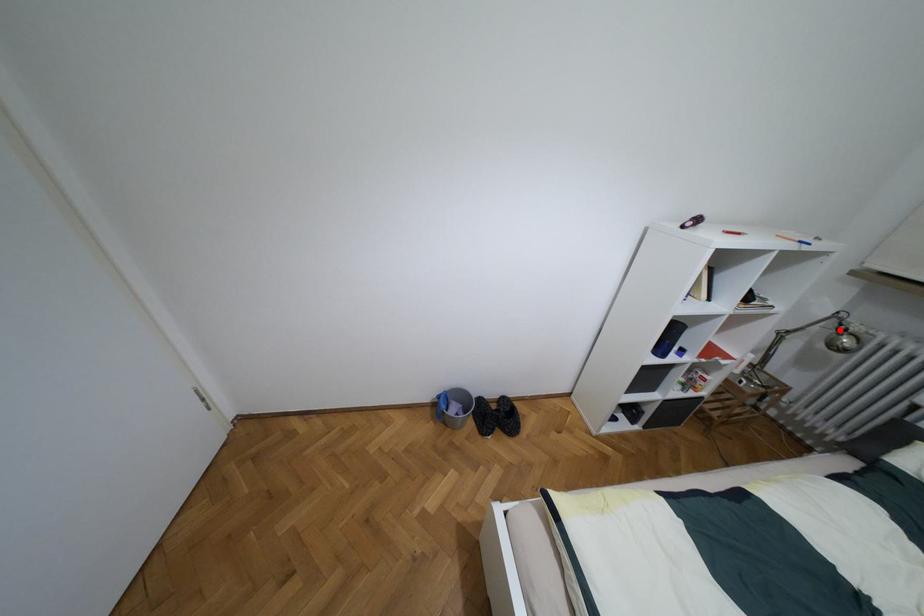
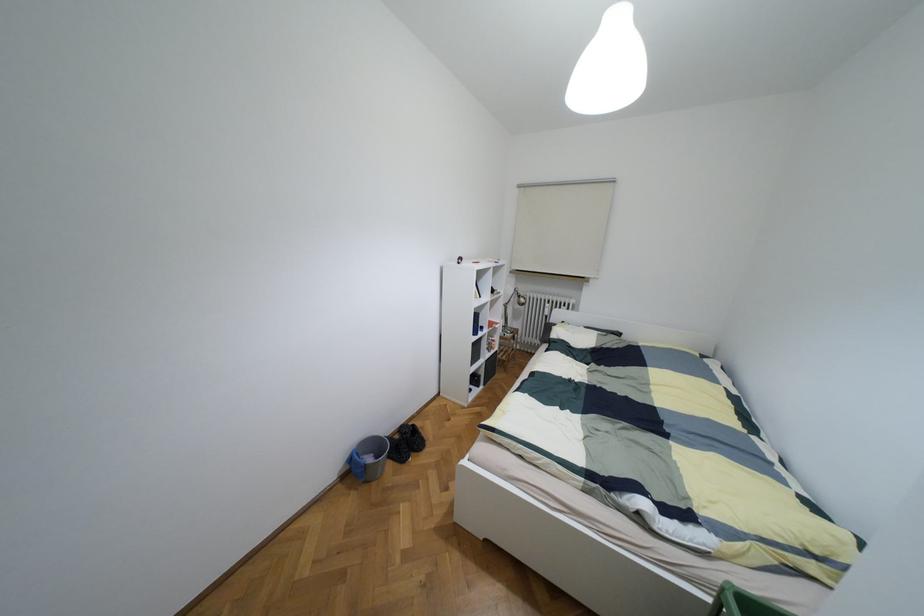
Find the pixel in the second image that matches the highlighted location in the first image.

(517, 296)